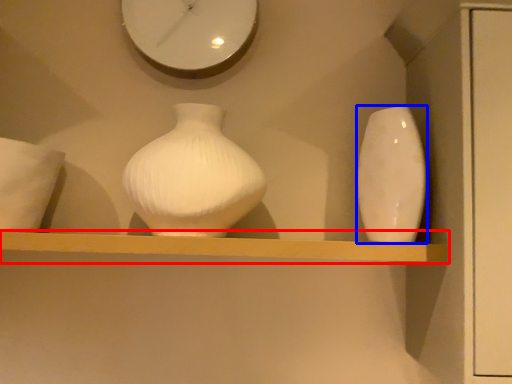
Question: Which point is closer to the camera, shelf (highlighted by a red box) or vase (highlighted by a blue box)?

Choices:
 (A) shelf
 (B) vase

Answer: (A)